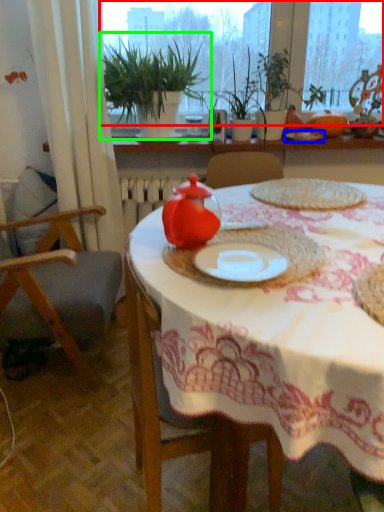
Question: Which is nearer to the window screen (highlighted by a red box)? tableware (highlighted by a blue box) or houseplant (highlighted by a green box).

Choices:
 (A) tableware
 (B) houseplant

Answer: (B)